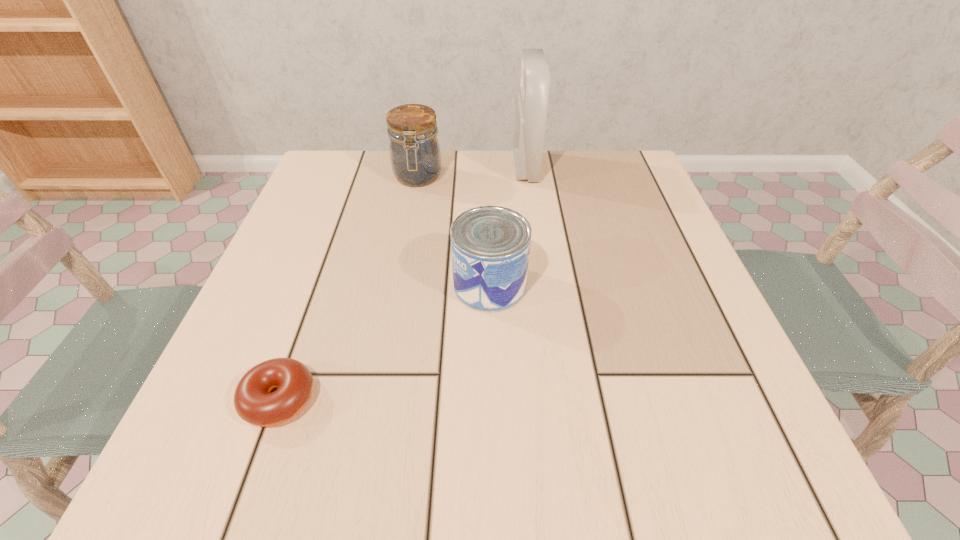
Find the location of a particular element. This screenshot has width=960, height=540. vacant space located 0.290m on the front-facing side of the rightmost object is located at coordinates (395, 167).

At what (x,y) coordinates should I click in order to perform the action: click on blank space located on the lid of the third shortest object. Please return your answer as a coordinate pair (x, y). The width and height of the screenshot is (960, 540). Looking at the image, I should click on [392, 322].

Locate an element on the screen. The image size is (960, 540). free space located 0.310m on the front label of the third object from left to right is located at coordinates (279, 285).

Where is `free spot located 0.220m on the front label of the third object from left to right`? free spot located 0.220m on the front label of the third object from left to right is located at coordinates (329, 285).

At what (x,y) coordinates should I click in order to perform the action: click on vacant space located on the front label of the third object from left to right. Please return your answer as a coordinate pair (x, y). This screenshot has height=540, width=960. Looking at the image, I should click on (307, 285).

Find the location of a particular element. This screenshot has height=540, width=960. vacant space located 0.250m on the right of the doughnut is located at coordinates (492, 399).

At what (x,y) coordinates should I click in order to perform the action: click on the first-aid kit that is at the far edge. Please return your answer as a coordinate pair (x, y). The height and width of the screenshot is (540, 960). Looking at the image, I should click on (531, 102).

In order to click on jar that is at the far edge in this screenshot , I will do `click(415, 156)`.

At what (x,y) coordinates should I click in order to perform the action: click on object positioned at the near edge. Please return your answer as a coordinate pair (x, y). Looking at the image, I should click on (254, 401).

At what (x,y) coordinates should I click in order to perform the action: click on object that is positioned at the left edge. Please return your answer as a coordinate pair (x, y). This screenshot has width=960, height=540. Looking at the image, I should click on (254, 401).